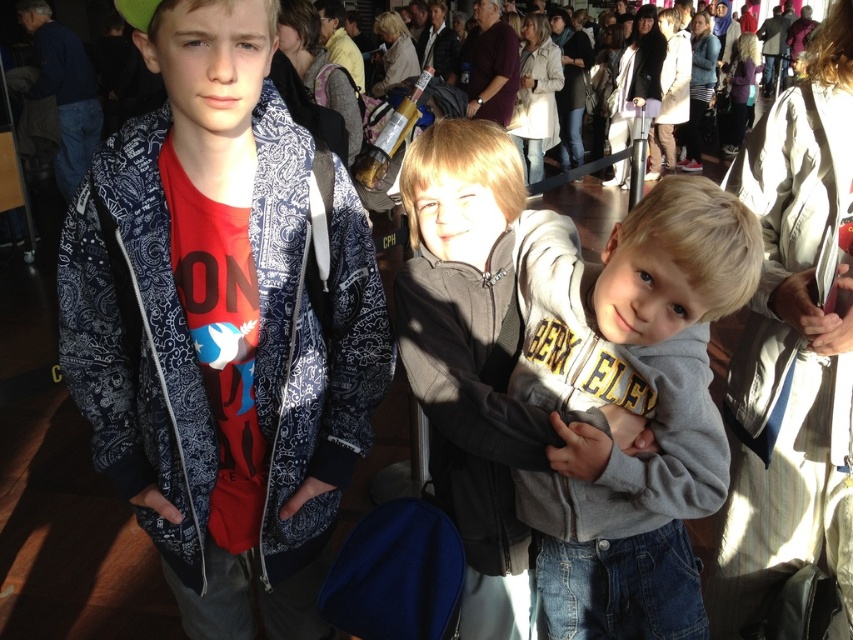
Who is higher up, matte blue jacket at center or gray fleece hoodie at center?

matte blue jacket at center is higher up.

What do you see at coordinates (219, 324) in the screenshot? This screenshot has width=853, height=640. I see `matte blue jacket at center` at bounding box center [219, 324].

Does point (131, 323) come closer to viewer compared to point (633, 241)?

No, it is behind (633, 241).

At what (x,y) coordinates should I click in order to perform the action: click on matte blue jacket at center. Please return your answer as a coordinate pair (x, y). Looking at the image, I should click on (219, 324).